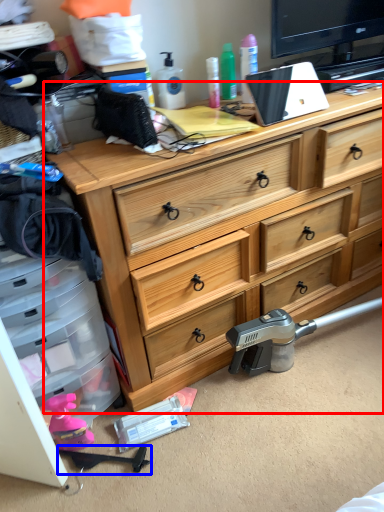
Question: Which of the following is the closest to the observer, chest of drawers (highlighted by a red box) or weapon (highlighted by a blue box)?

Choices:
 (A) chest of drawers
 (B) weapon

Answer: (A)